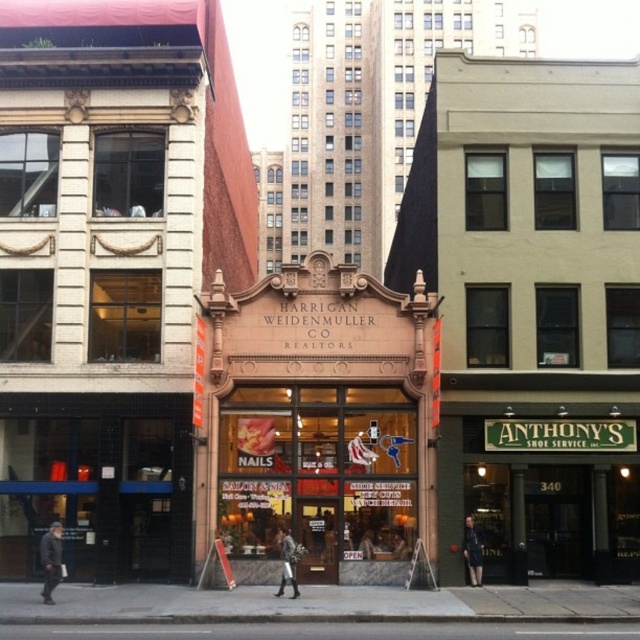
You are a window shopper walking past the HARRIGAN WEIDENMULLER CO REALTORS storefront. You notice two jackets displayed in the window. The dark gray jacket at lower left and the leather jacket at center. Which jacket appears taller in the display?

The dark gray jacket at lower left is much taller than the leather jacket at center, so the dark gray jacket at lower left appears taller in the display.

You are a customer entering the building and see the matte pink storefront at center and the dark blue fabric coat at center. Which object is located higher up?

The matte pink storefront at center is positioned over the dark blue fabric coat at center, so it is higher up.

You are a customer looking to enter the leather jacket at center located inside the building. However, there is a matte pink storefront at center blocking the entrance. Can you walk through the entrance without going around the obstruction?

The matte pink storefront at center is above the leather jacket at center, so the storefront is not blocking the entrance. You can walk through the entrance normally.